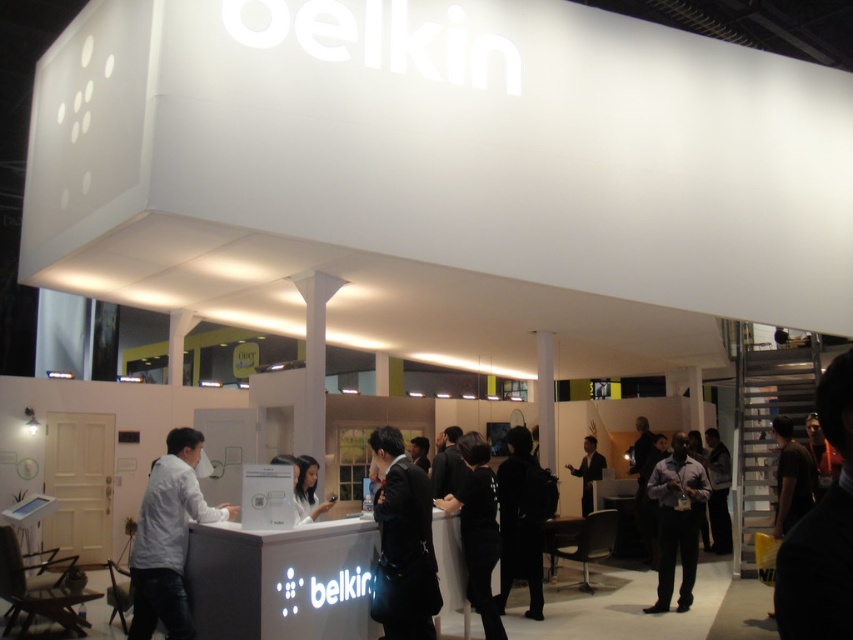
Question: Is matte black shirt at center below white glossy phone at center?

Choices:
 (A) yes
 (B) no

Answer: (A)

Question: Can you confirm if white matte shirt at left is positioned to the right of dark gray fabric jacket at lower right?

Choices:
 (A) yes
 (B) no

Answer: (B)

Question: Observing the image, what is the correct spatial positioning of black matte coat at center in reference to black suit at center?

Choices:
 (A) right
 (B) left

Answer: (B)

Question: Among these points, which one is nearest to the camera?

Choices:
 (A) (590, 458)
 (B) (721, 541)

Answer: (B)

Question: Among these points, which one is nearest to the camera?

Choices:
 (A) (582, 502)
 (B) (500, 596)
 (C) (419, 625)

Answer: (C)

Question: Which object is the closest to the black matte jacket at center?

Choices:
 (A) white glossy phone at center
 (B) matte black shirt at center
 (C) black leather jacket at center

Answer: (C)